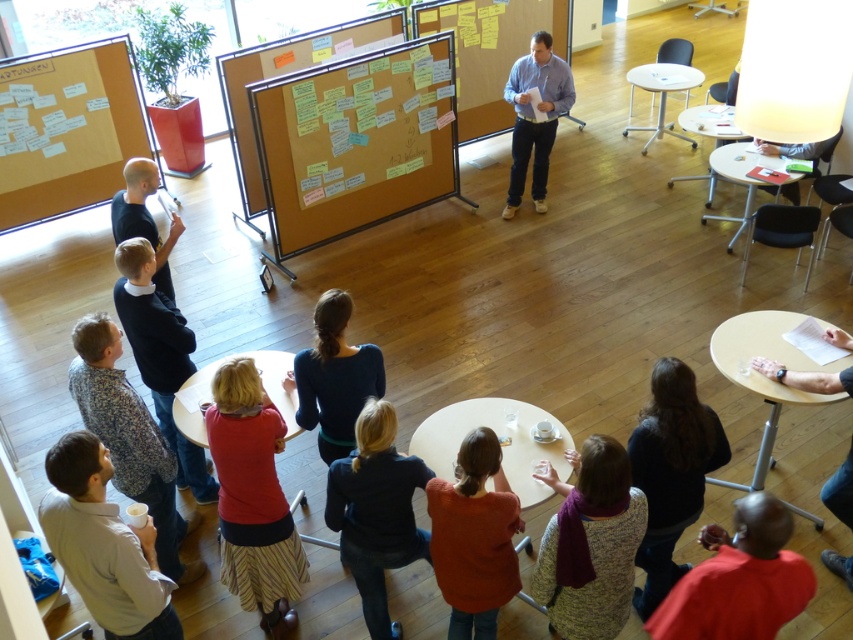
You are organizing a small workshop and need to seat 5 participants. The matte black table at lower right and white glossy table at upper right are available. Which table should you choose to accommodate everyone comfortably?

The white glossy table at upper right should be chosen because it occupies more space than the matte black table at lower right, providing enough seating for 5 participants comfortably.

You are organizing a photoshoot and need to place a model wearing a red coat exactly where the orange sweater at lower center is currently located. However, you must ensure that the model stays to the left of the teal sweater at center. Is this possible given their current positions?

The orange sweater at lower center is to the right of the teal sweater at center, so placing the model wearing a red coat at the orange sweater at lower center would naturally place them to the right of the teal sweater at center. To stay to the left of the teal sweater at center, the model should instead be positioned where the teal sweater at center is currently located or to its left side.